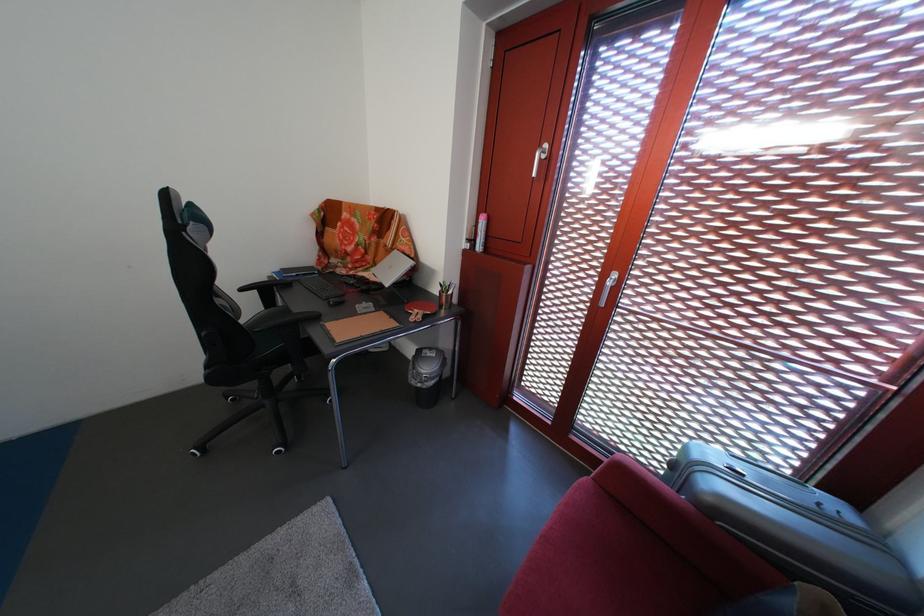
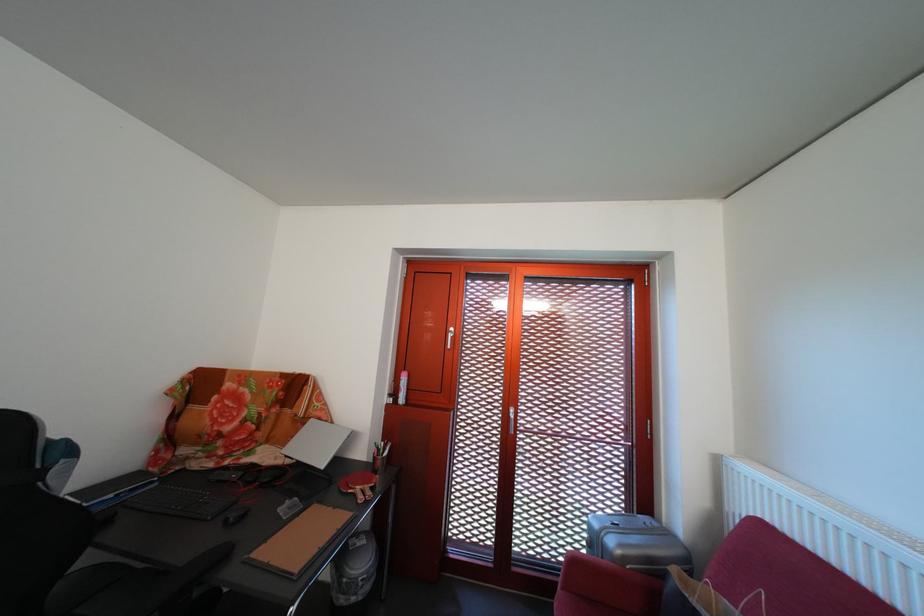
The images are taken continuously from a first-person perspective. In which direction is your viewpoint rotating?

The camera rotated toward right-up.